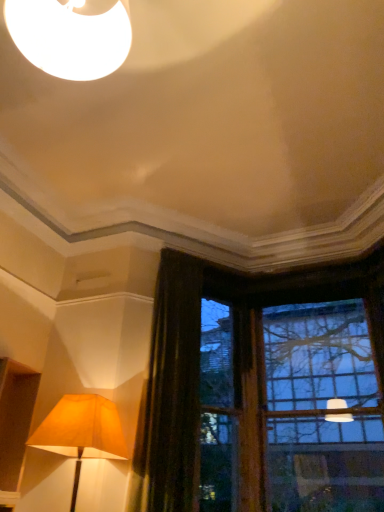
Question: Can you confirm if dark brown velvet curtain at left is smaller than matte gold lampshade at lower left?

Choices:
 (A) no
 (B) yes

Answer: (A)

Question: From the image's perspective, is dark brown velvet curtain at left located beneath matte gold lampshade at lower left?

Choices:
 (A) yes
 (B) no

Answer: (B)

Question: Considering the relative sizes of dark brown velvet curtain at left and matte gold lampshade at lower left in the image provided, is dark brown velvet curtain at left wider than matte gold lampshade at lower left?

Choices:
 (A) no
 (B) yes

Answer: (A)

Question: Is the depth of dark brown velvet curtain at left less than that of matte gold lampshade at lower left?

Choices:
 (A) yes
 (B) no

Answer: (B)

Question: Considering the relative sizes of dark brown velvet curtain at left and matte gold lampshade at lower left in the image provided, is dark brown velvet curtain at left bigger than matte gold lampshade at lower left?

Choices:
 (A) yes
 (B) no

Answer: (A)

Question: Does dark brown velvet curtain at left have a lesser height compared to matte gold lampshade at lower left?

Choices:
 (A) yes
 (B) no

Answer: (B)

Question: Does clear glass window at upper right have a greater height compared to matte gold lampshade at lower left?

Choices:
 (A) no
 (B) yes

Answer: (B)

Question: Is clear glass window at upper right further to the viewer compared to matte gold lampshade at lower left?

Choices:
 (A) no
 (B) yes

Answer: (B)

Question: From the image's perspective, would you say clear glass window at upper right is positioned over matte gold lampshade at lower left?

Choices:
 (A) no
 (B) yes

Answer: (B)

Question: From a real-world perspective, is clear glass window at upper right located beneath matte gold lampshade at lower left?

Choices:
 (A) no
 (B) yes

Answer: (A)

Question: From a real-world perspective, is clear glass window at upper right on matte gold lampshade at lower left?

Choices:
 (A) no
 (B) yes

Answer: (B)

Question: Is clear glass window at upper right smaller than matte gold lampshade at lower left?

Choices:
 (A) yes
 (B) no

Answer: (B)

Question: Does matte gold lampshade at lower left appear on the left side of clear glass window at upper right?

Choices:
 (A) no
 (B) yes

Answer: (B)